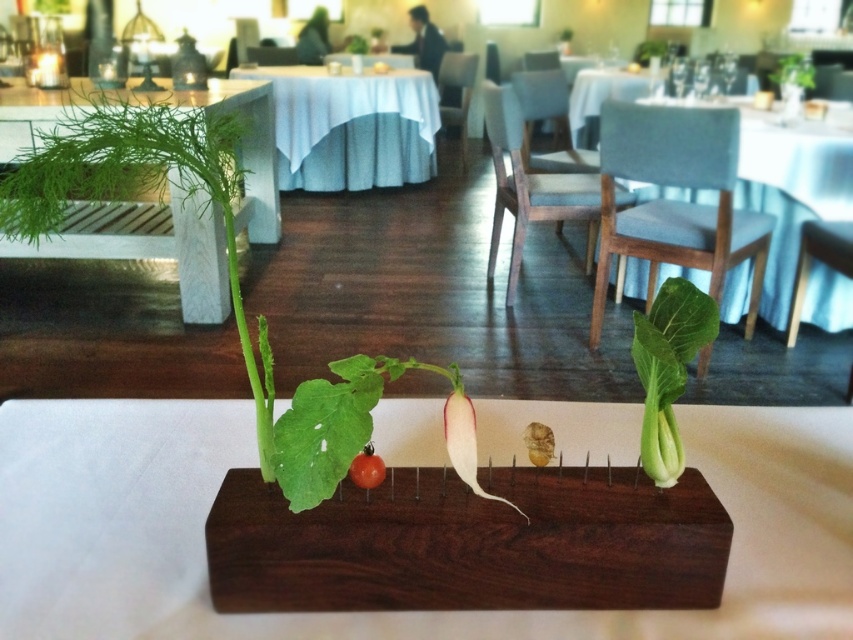
Is the position of dark wood rectangular block at center more distant than that of white cloth table at center?

That is False.

What do you see at coordinates (379, 612) in the screenshot?
I see `dark wood rectangular block at center` at bounding box center [379, 612].

The width and height of the screenshot is (853, 640). I want to click on dark wood rectangular block at center, so click(x=379, y=612).

At what (x,y) coordinates should I click in order to perform the action: click on white cloth table at center. Please return your answer as a coordinate pair (x, y). This screenshot has height=640, width=853. Looking at the image, I should click on (351, 125).

Between point (360, 134) and point (80, 92), which one is positioned behind?

The point (360, 134) is more distant.

Locate an element on the screen. This screenshot has height=640, width=853. white cloth table at center is located at coordinates (351, 125).

The width and height of the screenshot is (853, 640). Describe the element at coordinates (717, 196) in the screenshot. I see `wooden chair at center` at that location.

Who is higher up, wooden chair at center or green leafy bok choy at center?

Positioned higher is wooden chair at center.

Between point (830, 216) and point (659, 332), which one is positioned in front?

Positioned in front is point (659, 332).

Identify the location of wooden chair at center. This screenshot has width=853, height=640. 717,196.